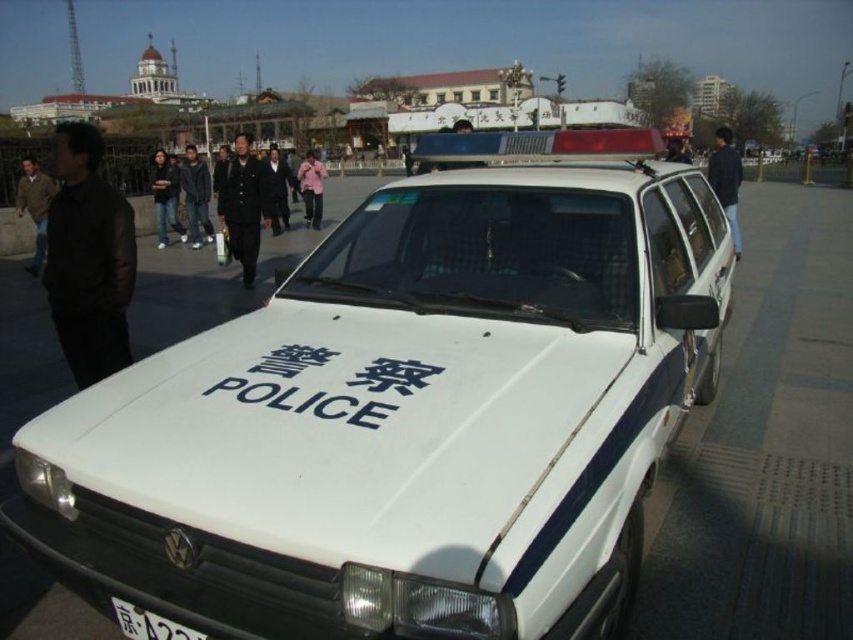
Is white matte/polished police sign at center taller than black cloth coat at center?

No, white matte/polished police sign at center is not taller than black cloth coat at center.

Identify the location of white matte/polished police sign at center. (325, 388).

Is blue jeans at right thinner than black leather jacket at center?

No, blue jeans at right is not thinner than black leather jacket at center.

Which is above, blue jeans at right or black leather jacket at center?

blue jeans at right is above.

Which is behind, point (720, 136) or point (677, 145)?

The point (720, 136) is more distant.

Find the location of `blue jeans at right`. blue jeans at right is located at coordinates pos(726,180).

Does black leather jacket at left appear on the right side of black leather jacket at center?

Incorrect, black leather jacket at left is not on the right side of black leather jacket at center.

Is point (100, 294) more distant than point (669, 152)?

No, it is not.

Is point (55, 141) closer to viewer compared to point (677, 161)?

Yes, it is.

This screenshot has width=853, height=640. In order to click on black leather jacket at left in this screenshot , I will do `click(88, 259)`.